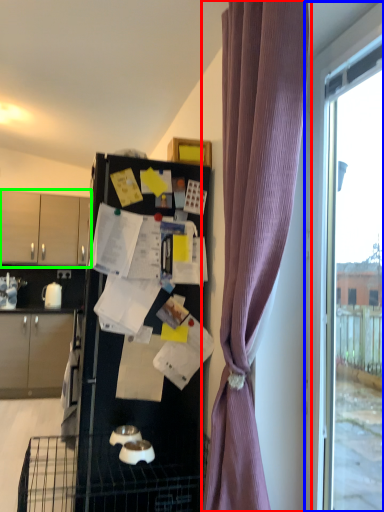
Question: Based on their relative distances, which object is nearer to curtain (highlighted by a red box)? Choose from window (highlighted by a blue box) and cabinetry (highlighted by a green box).

Choices:
 (A) window
 (B) cabinetry

Answer: (A)